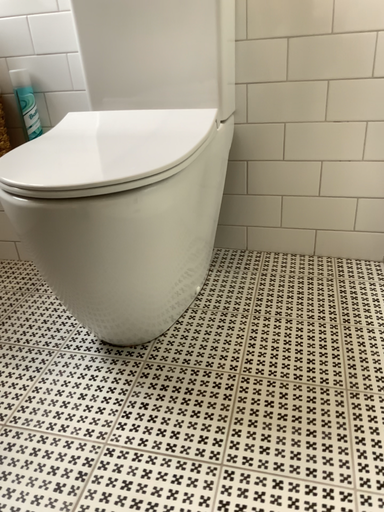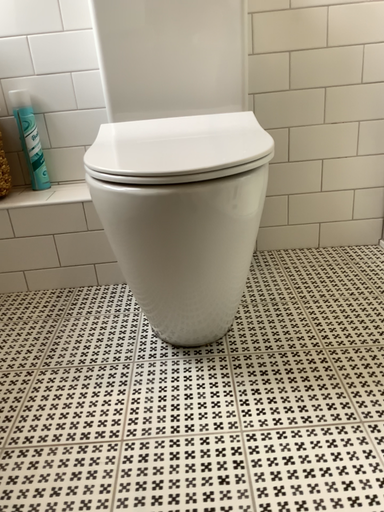
Question: Which way did the camera rotate in the video?

Choices:
 (A) rotated left
 (B) rotated right

Answer: (B)